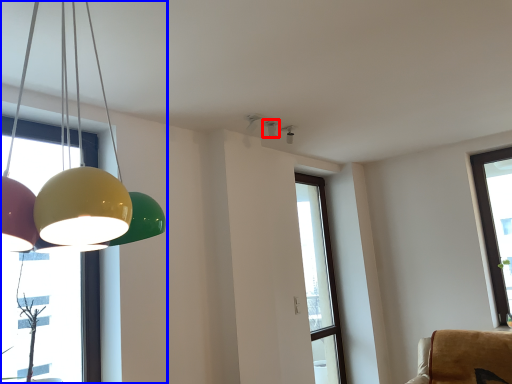
Question: Which of the following is the farthest to the observer, lamp (highlighted by a red box) or lamp (highlighted by a blue box)?

Choices:
 (A) lamp
 (B) lamp

Answer: (A)